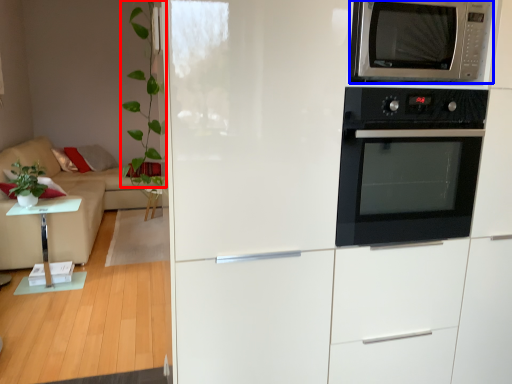
Question: Which object appears closest to the camera in this image, plant (highlighted by a red box) or microwave oven (highlighted by a blue box)?

Choices:
 (A) plant
 (B) microwave oven

Answer: (B)